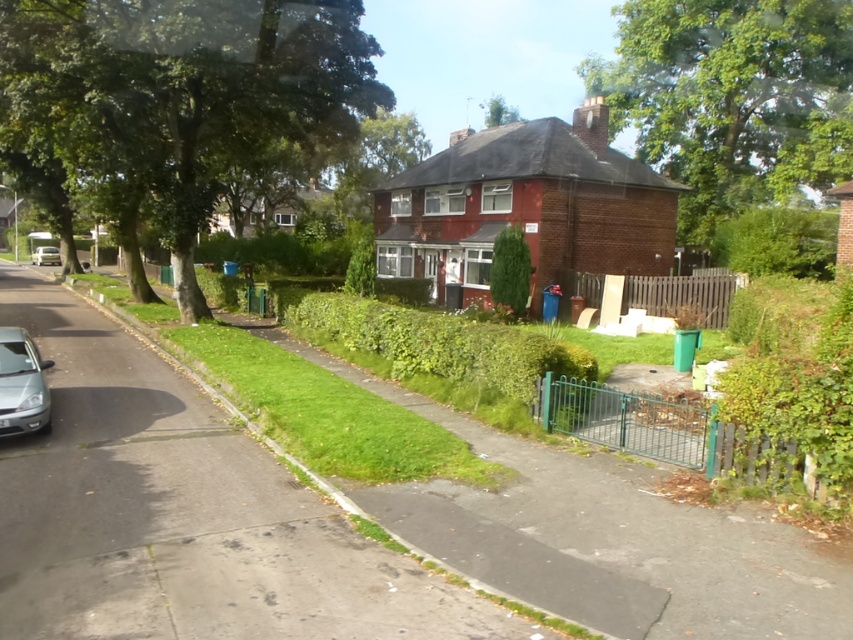
You are a delivery person trying to park your delivery van, which is 2.5 meters wide, in the residential street scene. The silver metallic car at lower left and the silver metallic car at left are parked on the side of the road. Can you determine if there is enough space between them to park your van?

The silver metallic car at lower left is wider than the silver metallic car at left. However, the exact width of the space between them isn

You are a delivery person approaching the house on the residential street. You need to park your car between the two silver metallic cars mentioned. Which car should you position your car next to, the silver metallic car at lower left or the silver metallic car at left, to ensure proper parking between them?

To park between them, you should position your car next to the silver metallic car at left, since the silver metallic car at lower left is to the right of it, creating space between both cars for your vehicle.